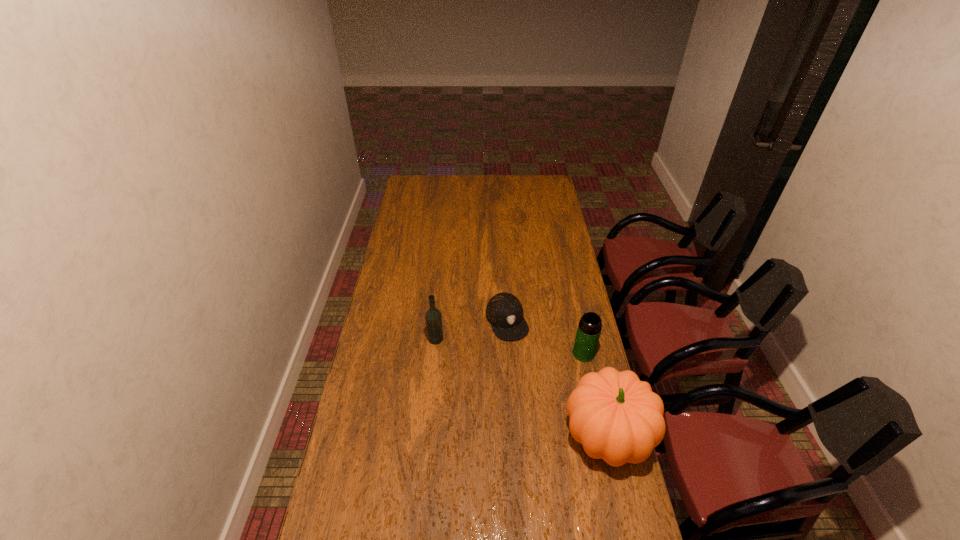
Image resolution: width=960 pixels, height=540 pixels. Find the location of `free space located from the spout of the thermos bottle`. free space located from the spout of the thermos bottle is located at coordinates (546, 360).

What are the coordinates of `free space located 0.320m from the spout of the thermos bottle` in the screenshot? It's located at (492, 368).

The width and height of the screenshot is (960, 540). I want to click on vacant region located 0.300m from the spout of the thermos bottle, so click(498, 368).

I want to click on pumpkin at the right edge, so click(x=616, y=417).

Identify the location of thermos bottle at the right edge. (589, 328).

I want to click on free region at the far edge of the desktop, so click(x=486, y=186).

In the image, there is a desktop. Identify the location of vacant space at the left edge. (399, 300).

Locate an element on the screen. vacant space at the right edge of the desktop is located at coordinates (550, 250).

Find the location of `vacant space that is in between the nearest object and the second object from left to right`. vacant space that is in between the nearest object and the second object from left to right is located at coordinates (558, 378).

The height and width of the screenshot is (540, 960). I want to click on free spot between the pumpkin and the leftmost object, so click(521, 387).